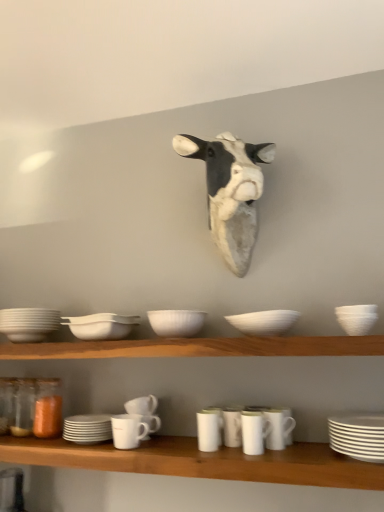
Question: From a real-world perspective, is white glossy mug at center, which is the 4th tableware in right-to-left order, located beneath white matte mug at lower center, the sixth tableware from the right?

Choices:
 (A) no
 (B) yes

Answer: (A)

Question: Is white glossy mug at center, which is the 4th tableware in right-to-left order, smaller than white matte mug at lower center, the 5th tableware when ordered from left to right?

Choices:
 (A) no
 (B) yes

Answer: (B)

Question: From a real-world perspective, is white glossy mug at center, which appears as the seventh tableware when viewed from the left, positioned over white matte mug at lower center, the sixth tableware from the right, based on gravity?

Choices:
 (A) no
 (B) yes

Answer: (B)

Question: Does white glossy mug at center, which appears as the seventh tableware when viewed from the left, turn towards white matte mug at lower center, the sixth tableware from the right?

Choices:
 (A) yes
 (B) no

Answer: (B)

Question: Does white glossy mug at center, which appears as the seventh tableware when viewed from the left, appear on the left side of white matte mug at lower center, the 5th tableware when ordered from left to right?

Choices:
 (A) yes
 (B) no

Answer: (B)

Question: Would you say white matte bowl at center, which is counted as the ninth tableware, starting from the right, is inside or outside translucent orange glass jar at lower left?

Choices:
 (A) inside
 (B) outside

Answer: (B)

Question: Would you say white matte bowl at center, the second tableware positioned from the left, is to the left or to the right of translucent orange glass jar at lower left in the picture?

Choices:
 (A) right
 (B) left

Answer: (A)

Question: From their relative heights in the image, would you say white matte bowl at center, which is counted as the ninth tableware, starting from the right, is taller or shorter than translucent orange glass jar at lower left?

Choices:
 (A) tall
 (B) short

Answer: (B)

Question: Based on their sizes in the image, would you say white matte bowl at center, which is counted as the ninth tableware, starting from the right, is bigger or smaller than translucent orange glass jar at lower left?

Choices:
 (A) big
 (B) small

Answer: (A)

Question: From the image's perspective, is white matte mug at center, the 7th tableware from the right, above or below white matte mug at lower center, marked as the eighth tableware in a right-to-left arrangement?

Choices:
 (A) below
 (B) above

Answer: (B)

Question: In terms of height, does white matte mug at center, the 7th tableware from the right, look taller or shorter compared to white matte mug at lower center, which is counted as the third tableware, starting from the left?

Choices:
 (A) tall
 (B) short

Answer: (B)

Question: From a real-world perspective, is white matte mug at center, the 7th tableware from the right, positioned above or below white matte mug at lower center, which is counted as the third tableware, starting from the left?

Choices:
 (A) above
 (B) below

Answer: (A)

Question: Based on their sizes in the image, would you say white matte mug at center, the 7th tableware from the right, is bigger or smaller than white matte mug at lower center, marked as the eighth tableware in a right-to-left arrangement?

Choices:
 (A) small
 (B) big

Answer: (A)

Question: Considering the positions of white matte bowl at center, which is counted as the ninth tableware, starting from the right, and wooden shelf at center in the image, is white matte bowl at center, which is counted as the ninth tableware, starting from the right, bigger or smaller than wooden shelf at center?

Choices:
 (A) small
 (B) big

Answer: (A)

Question: From their relative heights in the image, would you say white matte bowl at center, the second tableware positioned from the left, is taller or shorter than wooden shelf at center?

Choices:
 (A) tall
 (B) short

Answer: (A)